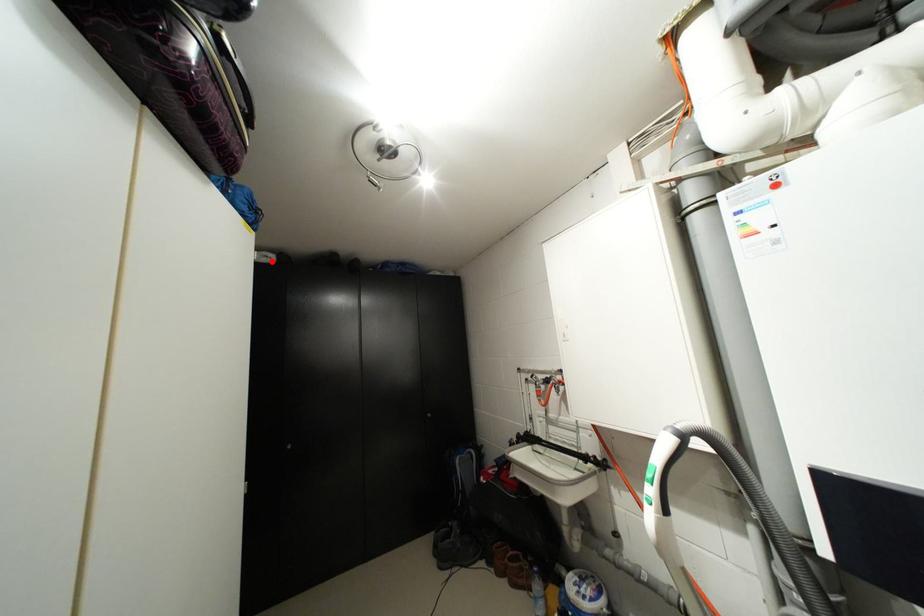
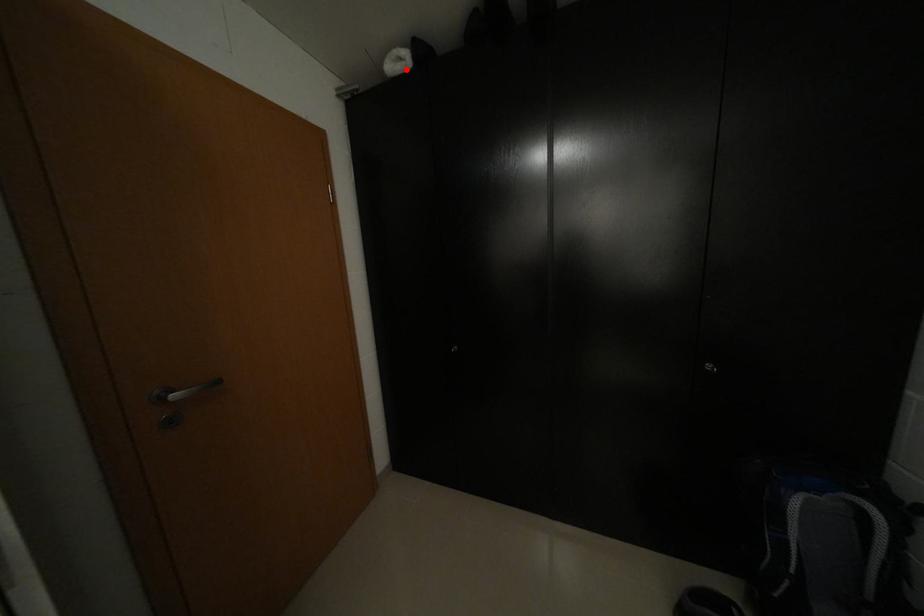
I am providing you with two images of the same scene from different viewpoints. A red point is marked on the first image and another point is marked on the second image. Are the points marked in image1 and image2 representing the same 3D position?

Yes